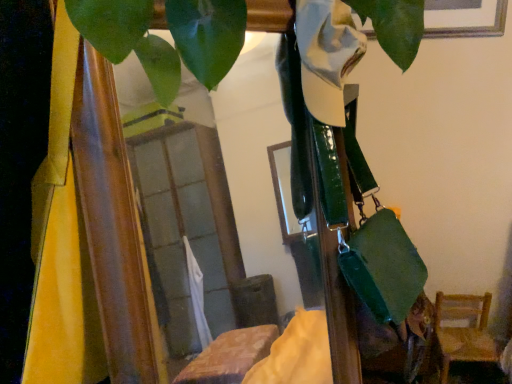
Measure the distance between point (x=467, y=294) and camera.

Point (x=467, y=294) is 2.20 meters away from camera.

Find the location of a particular element. wooden chair at lower right is located at coordinates (463, 331).

This screenshot has width=512, height=384. Describe the element at coordinates (463, 331) in the screenshot. I see `wooden chair at lower right` at that location.

Where is `wooden chair at lower right`? The width and height of the screenshot is (512, 384). wooden chair at lower right is located at coordinates (463, 331).